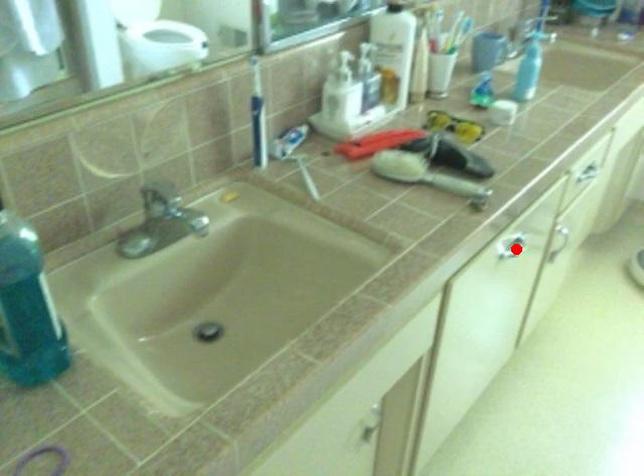
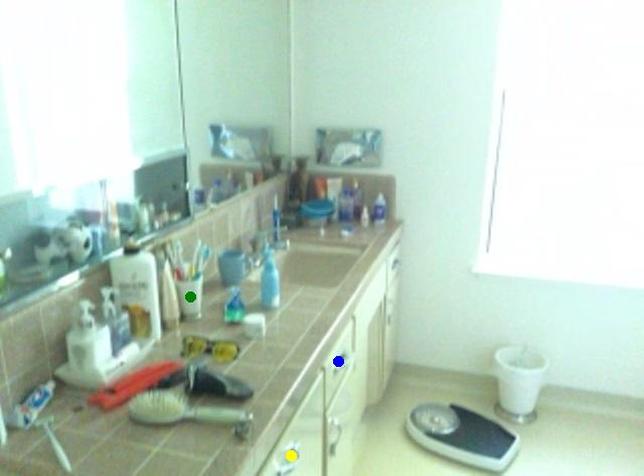
Question: I am providing you with two images of the same scene from different viewpoints. A red point is marked on the first image. You are given multiple points on the second image. Which mark in image 2 goes with the point in image 1?

Choices:
 (A) blue point
 (B) yellow point
 (C) green point

Answer: (B)